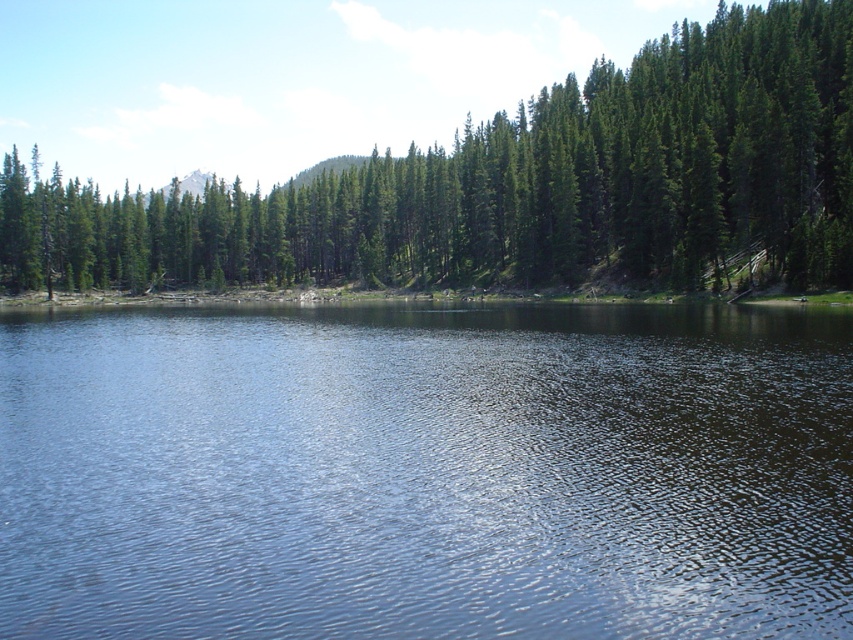
Can you confirm if clear water at center is positioned above green matte tree at upper center?

Incorrect, clear water at center is not positioned above green matte tree at upper center.

Which of these two, clear water at center or green matte tree at upper center, stands shorter?

With less height is clear water at center.

Measure the distance between clear water at center and camera.

clear water at center is 33.02 feet from camera.

Locate an element on the screen. This screenshot has width=853, height=640. clear water at center is located at coordinates (426, 472).